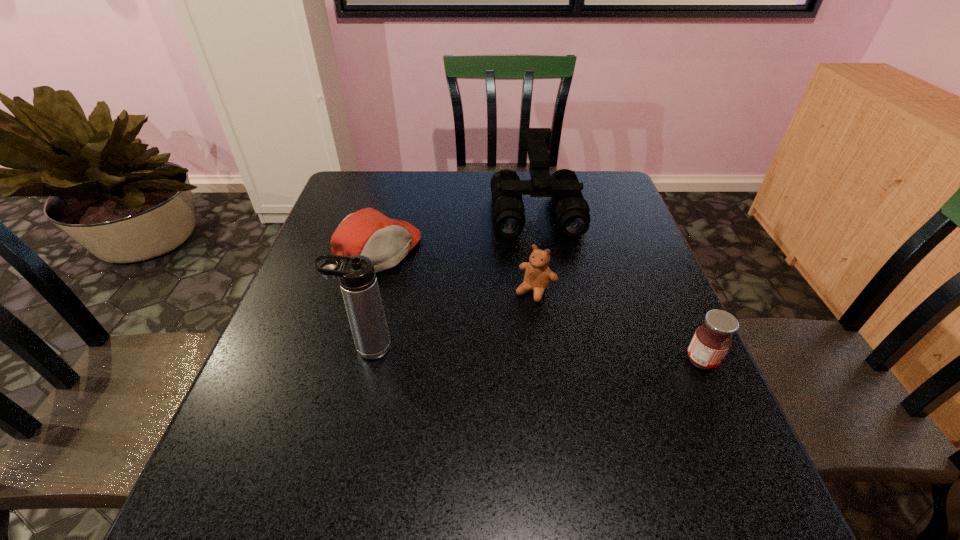
Identify the location of the tallest object. (357, 278).

Identify the location of the rightmost object. This screenshot has width=960, height=540. (711, 341).

What are the coordinates of `cap` in the screenshot? It's located at click(367, 232).

The height and width of the screenshot is (540, 960). I want to click on the fourth shortest object, so tap(571, 209).

Locate an element on the screen. teddy bear is located at coordinates (538, 275).

What are the coordinates of `free space located on the handle side of the thermos bottle` in the screenshot? It's located at (300, 348).

Identify the location of vacant space located on the handle side of the thermos bottle. (300, 348).

Find the location of a particular element. The image size is (960, 540). free space located 0.160m on the handle side of the thermos bottle is located at coordinates (267, 348).

You are a GUI agent. You are given a task and a screenshot of the screen. Output one action in this format:
    pyautogui.click(x=<x>, y=<y>)
    Task: Click on the vacant space situated on the front-facing side of the cap
    This screenshot has height=540, width=960.
    Given the screenshot: What is the action you would take?
    pyautogui.click(x=475, y=307)

Identify the location of free space located 0.360m on the front-facing side of the cap. This screenshot has width=960, height=540. (520, 333).